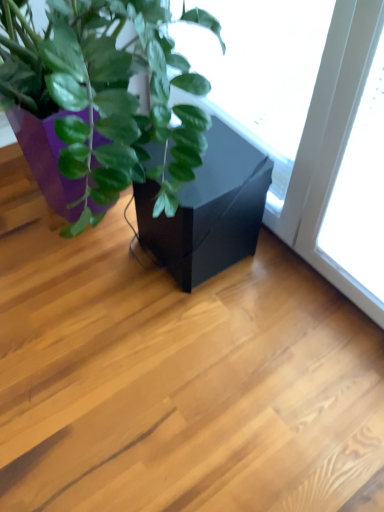
You are a GUI agent. You are given a task and a screenshot of the screen. Output one action in this format:
    pyautogui.click(x=<x>, y=<y>)
    Task: Click on the vacant region to the left of black matte flowerpot at center
    
    Given the screenshot: What is the action you would take?
    pyautogui.click(x=100, y=262)